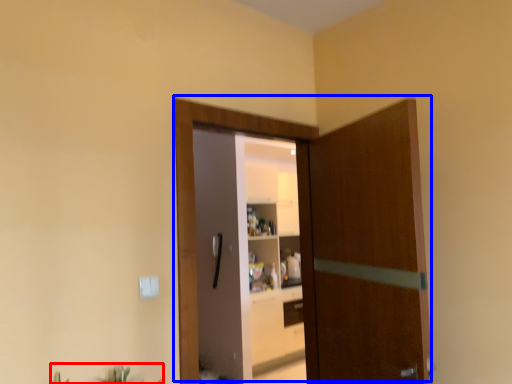
Question: Which object is further to the camera taking this photo, plant (highlighted by a red box) or door (highlighted by a blue box)?

Choices:
 (A) plant
 (B) door

Answer: (B)